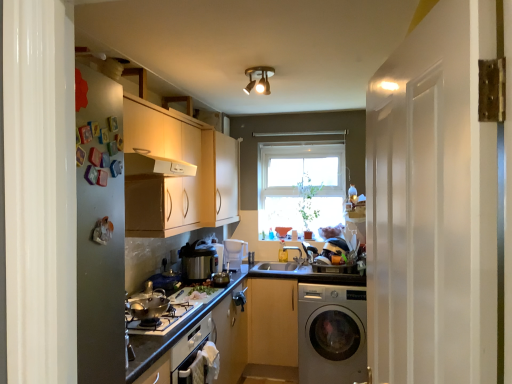
Locate an element on the screen. black plastic door handle at lower center is located at coordinates (240, 298).

What are the coordinates of `satin silver rice cooker at center, which appears as the 3th appliance when viewed from the front` in the screenshot? It's located at (217, 253).

Measure the distance between point (230, 253) and camera.

Point (230, 253) and camera are 12.32 feet apart.

I want to click on white plastic container at center, which is counted as the 1th appliance, starting from the back, so click(234, 254).

Locate an element on the screen. This screenshot has width=512, height=384. white glossy door at right is located at coordinates (434, 204).

Where is `black plastic door handle at lower center`? black plastic door handle at lower center is located at coordinates (240, 298).

From a real-world perspective, which is physically above, light wood cabinet at center, arranged as the 1th cabinetry when viewed from the right, or metallic silver rice cooker at center, placed as the second appliance when sorted from front to back?

In real-world perspective, metallic silver rice cooker at center, placed as the second appliance when sorted from front to back, is above.

From the image's perspective, is light wood cabinet at center, positioned as the second cabinetry in left-to-right order, positioned above or below metallic silver rice cooker at center, the 3th appliance in the back-to-front sequence?

Based on their image positions, light wood cabinet at center, positioned as the second cabinetry in left-to-right order, is located beneath metallic silver rice cooker at center, the 3th appliance in the back-to-front sequence.

How far apart are light wood cabinet at center, positioned as the second cabinetry in left-to-right order, and metallic silver rice cooker at center, placed as the second appliance when sorted from front to back?

light wood cabinet at center, positioned as the second cabinetry in left-to-right order, and metallic silver rice cooker at center, placed as the second appliance when sorted from front to back, are 30.16 inches apart.

Which is in front, light wood cabinet at center, the first cabinetry in the bottom-to-top sequence, or metallic silver rice cooker at center, the 3th appliance in the back-to-front sequence?

metallic silver rice cooker at center, the 3th appliance in the back-to-front sequence.

Between matte white cabinets at center, the second cabinetry in the right-to-left sequence, and shiny silver pot at lower left, placed as the first appliance when sorted from front to back, which one appears on the right side from the viewer's perspective?

matte white cabinets at center, the second cabinetry in the right-to-left sequence.

Could you tell me if matte white cabinets at center, the first cabinetry viewed from the left, is facing shiny silver pot at lower left, positioned as the 4th appliance in back-to-front order?

No, matte white cabinets at center, the first cabinetry viewed from the left, is not turned towards shiny silver pot at lower left, positioned as the 4th appliance in back-to-front order.

In order to click on cabinetry above the shiny silver pot at lower left, placed as the first appliance when sorted from front to back (from a real-world perspective) in this screenshot , I will do tap(219, 179).

Is matte white cabinets at center, arranged as the first cabinetry when viewed from the top, situated inside shiny silver pot at lower left, placed as the first appliance when sorted from front to back, or outside?

matte white cabinets at center, arranged as the first cabinetry when viewed from the top, lies outside shiny silver pot at lower left, placed as the first appliance when sorted from front to back.

Can you confirm if matte white cabinets at center, the first cabinetry viewed from the left, is wider than black plastic door handle at lower center?

Yes, matte white cabinets at center, the first cabinetry viewed from the left, is wider than black plastic door handle at lower center.

Is matte white cabinets at center, arranged as the first cabinetry when viewed from the top, closer to camera compared to black plastic door handle at lower center?

No, matte white cabinets at center, arranged as the first cabinetry when viewed from the top, is further to the viewer.

Is matte white cabinets at center, which is the 2th cabinetry from bottom to top, directly adjacent to black plastic door handle at lower center?

No, matte white cabinets at center, which is the 2th cabinetry from bottom to top, is not beside black plastic door handle at lower center.

Is brass/bronze finish spotlight at upper center positioned with its back to light wood cabinet at center, the second cabinetry from the top?

No, brass/bronze finish spotlight at upper center's orientation is not away from light wood cabinet at center, the second cabinetry from the top.

Consider the image. Measure the distance from brass/bronze finish spotlight at upper center to light wood cabinet at center, the first cabinetry in the bottom-to-top sequence.

A distance of 6.16 feet exists between brass/bronze finish spotlight at upper center and light wood cabinet at center, the first cabinetry in the bottom-to-top sequence.

Can you confirm if brass/bronze finish spotlight at upper center is positioned to the right of light wood cabinet at center, the second cabinetry from the top?

Incorrect, brass/bronze finish spotlight at upper center is not on the right side of light wood cabinet at center, the second cabinetry from the top.

Is shiny silver pot at lower left, positioned as the 4th appliance in back-to-front order, oriented towards black plastic door handle at lower center?

No, shiny silver pot at lower left, positioned as the 4th appliance in back-to-front order, is not oriented towards black plastic door handle at lower center.

Image resolution: width=512 pixels, height=384 pixels. In order to click on the 4th appliance counting from the left side of the black plastic door handle at lower center in this screenshot , I will do `click(148, 305)`.

In the scene shown: Which is more distant, (148, 287) or (241, 292)?

The point (241, 292) is farther.

Which object is thinner, shiny silver pot at lower left, positioned as the 4th appliance in back-to-front order, or black plastic door handle at lower center?

Thinner between the two is black plastic door handle at lower center.

Where is `the 2nd cabinetry behind the white glossy door at right`? The width and height of the screenshot is (512, 384). the 2nd cabinetry behind the white glossy door at right is located at coordinates (272, 321).

Considering the relative sizes of white glossy door at right and light wood cabinet at center, the second cabinetry from the top, in the image provided, is white glossy door at right shorter than light wood cabinet at center, the second cabinetry from the top,?

In fact, white glossy door at right may be taller than light wood cabinet at center, the second cabinetry from the top.

Considering the sizes of objects white glossy door at right and light wood cabinet at center, the second cabinetry from the top, in the image provided, who is wider, white glossy door at right or light wood cabinet at center, the second cabinetry from the top,?

Wider between the two is light wood cabinet at center, the second cabinetry from the top.

Does white glossy door at right touch light wood cabinet at center, the second cabinetry from the top?

No, white glossy door at right is not making contact with light wood cabinet at center, the second cabinetry from the top.

What's the angular difference between black plastic door handle at lower center and metallic silver rice cooker at center, placed as the second appliance when sorted from front to back,'s facing directions?

There is a 0.728-degree angle between the facing directions of black plastic door handle at lower center and metallic silver rice cooker at center, placed as the second appliance when sorted from front to back.

From the picture: Which object is positioned more to the right, black plastic door handle at lower center or metallic silver rice cooker at center, placed as the second appliance when sorted from front to back?

Positioned to the right is black plastic door handle at lower center.

Is black plastic door handle at lower center next to metallic silver rice cooker at center, the 3th appliance in the back-to-front sequence, and touching it?

black plastic door handle at lower center is not next to metallic silver rice cooker at center, the 3th appliance in the back-to-front sequence, and they're not touching.

Image resolution: width=512 pixels, height=384 pixels. What are the coordinates of `the 4th appliance positioned above the light wood cabinet at center, the first cabinetry in the bottom-to-top sequence (from a real-world perspective)` in the screenshot? It's located at (198, 261).

Which cabinetry is the 1st one when counting from the right side of the shiny silver pot at lower left, positioned as the 4th appliance in back-to-front order? Please provide its 2D coordinates.

[(219, 179)]

When comparing their distances from silver metallic washing machine at lower right, does brass/bronze finish spotlight at upper center or metallic silver rice cooker at center, the 3th appliance in the back-to-front sequence, seem further?

brass/bronze finish spotlight at upper center lies further to silver metallic washing machine at lower right than the other object.

Looking at the image, which one is located closer to shiny silver pot at lower left, positioned as the 4th appliance in back-to-front order, matte white cabinets at center, which is the 2th cabinetry from bottom to top, or brass/bronze finish spotlight at upper center?

matte white cabinets at center, which is the 2th cabinetry from bottom to top, lies closer to shiny silver pot at lower left, positioned as the 4th appliance in back-to-front order, than the other object.

Which object lies further to the anchor point white plastic container at center, which is counted as the 1th appliance, starting from the back, matte white cabinets at center, the second cabinetry in the right-to-left sequence, or metallic silver rice cooker at center, placed as the second appliance when sorted from front to back?

matte white cabinets at center, the second cabinetry in the right-to-left sequence, lies further to white plastic container at center, which is counted as the 1th appliance, starting from the back, than the other object.

Looking at the image, which one is located closer to white plastic container at center, which is counted as the fourth appliance, starting from the front, clear glass window at center or brass/bronze finish spotlight at upper center?

Based on the image, clear glass window at center appears to be nearer to white plastic container at center, which is counted as the fourth appliance, starting from the front.

Which object lies further to the anchor point white glossy door at right, metallic silver rice cooker at center, placed as the second appliance when sorted from front to back, or black plastic door handle at lower center?

Based on the image, black plastic door handle at lower center appears to be further to white glossy door at right.

From the image, which object appears to be farther from matte white cabinets at center, the second cabinetry in the right-to-left sequence, brass/bronze finish spotlight at upper center or metallic silver rice cooker at center, placed as the second appliance when sorted from front to back?

Based on the image, brass/bronze finish spotlight at upper center appears to be further to matte white cabinets at center, the second cabinetry in the right-to-left sequence.

Looking at the image, which one is located closer to white glossy door at right, white plastic container at center, which is counted as the fourth appliance, starting from the front, or light wood cabinet at center, the second cabinetry from the top?

Answer: light wood cabinet at center, the second cabinetry from the top, lies closer to white glossy door at right than the other object.

When comparing their distances from shiny silver pot at lower left, placed as the first appliance when sorted from front to back, does white plastic container at center, which is counted as the 1th appliance, starting from the back, or satin silver rice cooker at center, positioned as the second appliance in back-to-front order, seem further?

white plastic container at center, which is counted as the 1th appliance, starting from the back.

The width and height of the screenshot is (512, 384). In order to click on door handle between white plastic container at center, which is counted as the 1th appliance, starting from the back, and smooth white countertop at center from left to right in this screenshot , I will do `click(240, 298)`.

Locate an element on the screen. The width and height of the screenshot is (512, 384). door handle positioned between brass/bronze finish spotlight at upper center and clear glass window at center from near to far is located at coordinates (240, 298).

Locate an element on the screen. The width and height of the screenshot is (512, 384). window situated between satin silver rice cooker at center, positioned as the second appliance in back-to-front order, and smooth white countertop at center from left to right is located at coordinates (301, 184).

The width and height of the screenshot is (512, 384). Find the location of `door handle between white glossy door at right and clear glass window at center from front to back`. door handle between white glossy door at right and clear glass window at center from front to back is located at coordinates (240, 298).